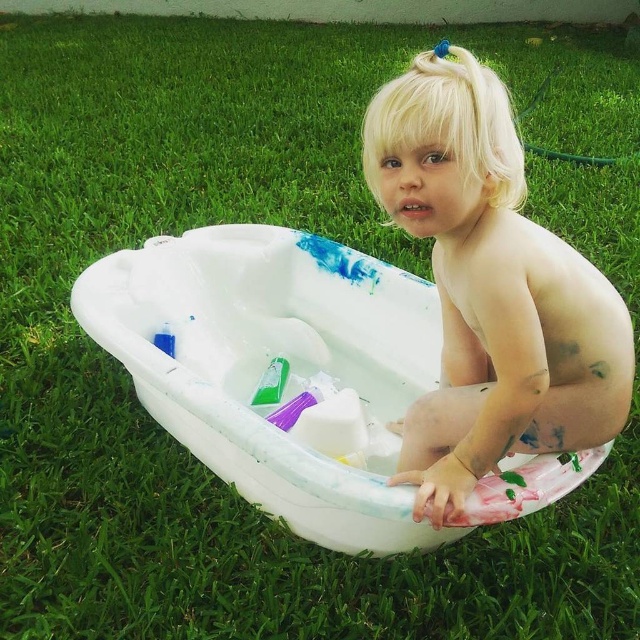
Consider the image. The child has blonde hair at upper center and a green plastic cup at center. Which object is bigger?

The blonde hair at upper center has a larger size compared to the green plastic cup at center.

The child wants to pour the green liquid from the green plastic cup at center into the white plastic tub at center. Will the cup fit inside the tub?

The white plastic tub at center has a greater height compared to the green plastic cup at center, so the cup can fit inside the tub as long as the cup is small enough to fit within the tub.

You are a parent trying to clean up after your child. You have a white plastic tub at center and a green plastic cup at center. Which object should you use to rinse the paint off the child?

The white plastic tub at center is larger in size than the green plastic cup at center, so you should use the white plastic tub at center to rinse the paint off the child because it can hold more water.